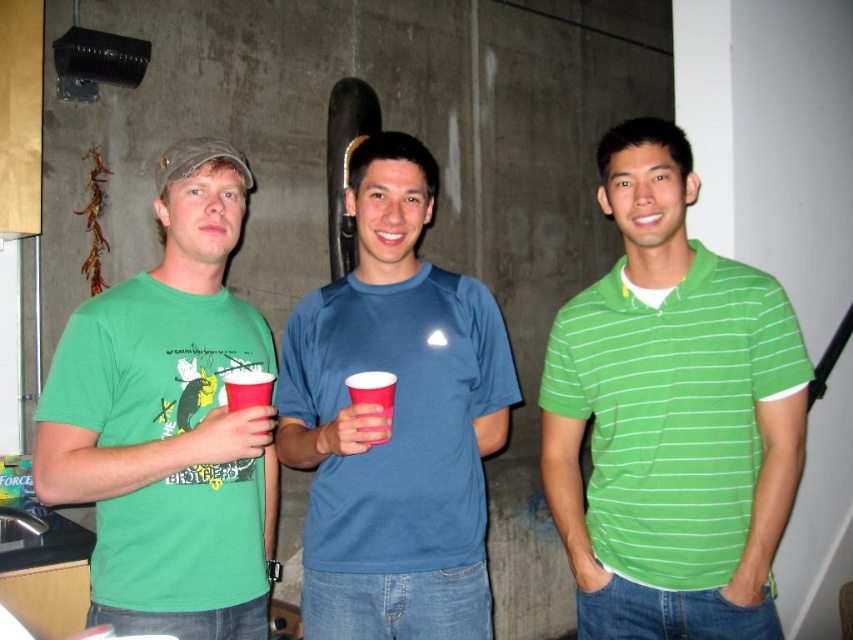
Is matte green t-shirt at left bigger than red plastic cup at center?

Yes, matte green t-shirt at left is bigger than red plastic cup at center.

Does point (148, 600) lie in front of point (381, 388)?

That is False.

Measure the distance between matte green t-shirt at left and camera.

1.38 meters

Where is `matte green t-shirt at left`? matte green t-shirt at left is located at coordinates (169, 422).

Is green striped polo shirt at center to the right of matte green t-shirt at left from the viewer's perspective?

Yes, green striped polo shirt at center is to the right of matte green t-shirt at left.

Is green striped polo shirt at center further to the viewer compared to matte green t-shirt at left?

Yes, it is.

Which is in front, point (613, 616) or point (173, 627)?

Point (173, 627)

You are a GUI agent. You are given a task and a screenshot of the screen. Output one action in this format:
    pyautogui.click(x=<x>, y=<y>)
    Task: Click on the green striped polo shirt at center
    The width and height of the screenshot is (853, 640).
    Given the screenshot: What is the action you would take?
    pyautogui.click(x=671, y=416)

Between green striped polo shirt at center and matte plastic cup at center, which one appears on the right side from the viewer's perspective?

Positioned to the right is green striped polo shirt at center.

Is green striped polo shirt at center thinner than matte plastic cup at center?

In fact, green striped polo shirt at center might be wider than matte plastic cup at center.

Who is more forward, [598,150] or [242,408]?

Positioned in front is point [242,408].

Where is `green striped polo shirt at center`? This screenshot has height=640, width=853. green striped polo shirt at center is located at coordinates (671, 416).